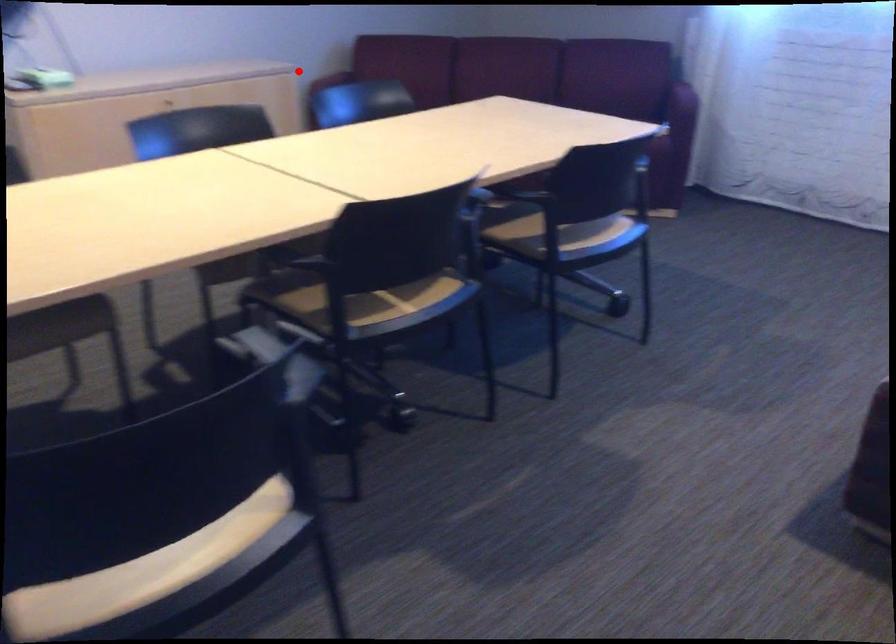
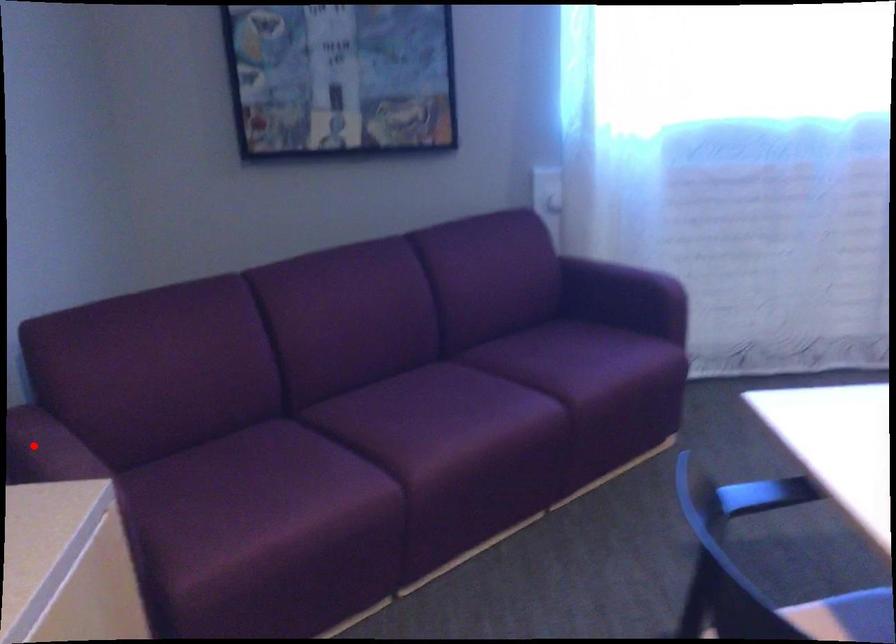
I am providing you with two images of the same scene from different viewpoints. A red point is marked on the first image and another point is marked on the second image. Are the points marked in image1 and image2 representing the same 3D position?

Yes